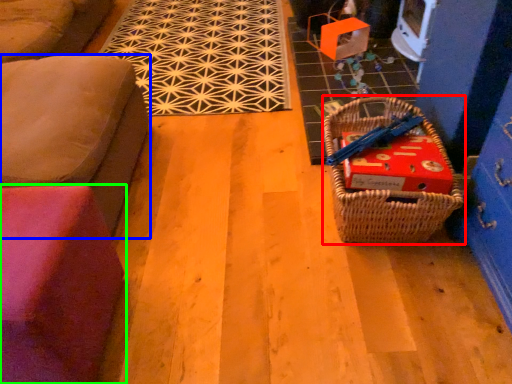
Question: Based on their relative distances, which object is farther from picnic basket (highlighted by a red box)? Choose from furniture (highlighted by a blue box) and furniture (highlighted by a green box).

Choices:
 (A) furniture
 (B) furniture

Answer: (A)